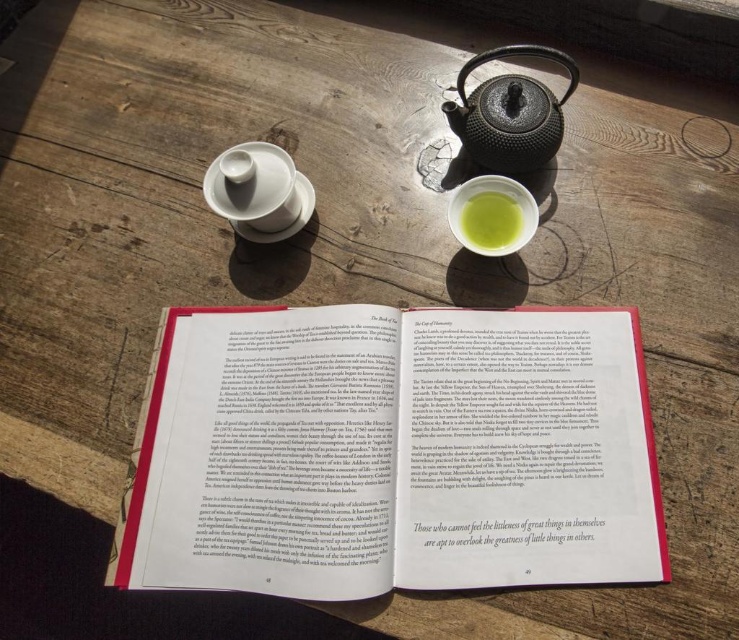
Is matte black teapot at upper center positioned before white matte saucer at center?

Yes, it is in front of white matte saucer at center.

Is matte black teapot at upper center taller than white matte saucer at center?

Correct, matte black teapot at upper center is much taller as white matte saucer at center.

Is point (497, 84) more distant than point (290, 227)?

No, (497, 84) is in front of (290, 227).

Image resolution: width=739 pixels, height=640 pixels. I want to click on matte black teapot at upper center, so click(x=507, y=131).

Is matte green porcelain cup at center below green matte bowl at center?

No.

Which is behind, point (520, 227) or point (511, 202)?

The point (511, 202) is behind.

Find the location of a particular element. Image resolution: width=739 pixels, height=640 pixels. matte green porcelain cup at center is located at coordinates (491, 216).

Where is `matte green porcelain cup at center`? matte green porcelain cup at center is located at coordinates (491, 216).

Does black textured teapot at upper center have a lesser width compared to white matte saucer at center?

Incorrect, black textured teapot at upper center's width is not less than white matte saucer at center's.

Is black textured teapot at upper center to the left of white matte saucer at center from the viewer's perspective?

Incorrect, black textured teapot at upper center is not on the left side of white matte saucer at center.

You are a GUI agent. You are given a task and a screenshot of the screen. Output one action in this format:
    pyautogui.click(x=<x>, y=<y>)
    Task: Click on the black textured teapot at upper center
    The height and width of the screenshot is (640, 739).
    Given the screenshot: What is the action you would take?
    pyautogui.click(x=508, y=113)